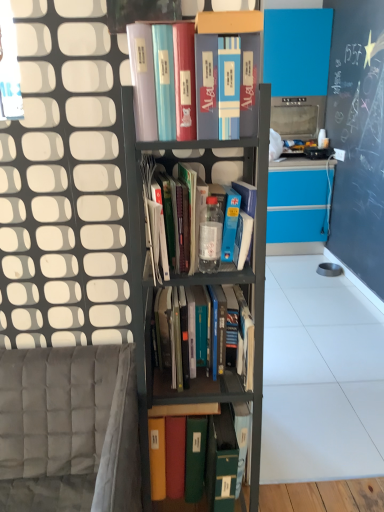
This screenshot has width=384, height=512. What do you see at coordinates (211, 163) in the screenshot?
I see `translucent plastic bottle at center, positioned as the 3th book in bottom-to-top order` at bounding box center [211, 163].

Measure the distance between point [252,49] and camera.

Point [252,49] is 97.00 centimeters away from camera.

The height and width of the screenshot is (512, 384). I want to click on green matte folder at center, the first book ordered from the bottom, so click(181, 409).

Is matte plastic books at upper center, the 1th book when ordered from top to bottom, far from gray fabric armchair at lower left?

They are positioned close to each other.

From a real-world perspective, is matte plastic books at upper center, which appears as the 4th book when ordered from the bottom, below gray fabric armchair at lower left?

No.

Looking at this image, does matte plastic books at upper center, the 1th book when ordered from top to bottom, appear on the right side of gray fabric armchair at lower left?

Yes.

From a real-world perspective, between translucent plastic bottle at center, positioned as the 3th book in bottom-to-top order, and green matte folder at center, the first book ordered from the bottom, who is vertically higher?

translucent plastic bottle at center, positioned as the 3th book in bottom-to-top order, from a real-world perspective.

Between translucent plastic bottle at center, positioned as the 2th book in top-to-bottom order, and green matte folder at center, the first book ordered from the bottom, which one has smaller width?

translucent plastic bottle at center, positioned as the 2th book in top-to-bottom order, is thinner.

From the picture: Is translucent plastic bottle at center, positioned as the 2th book in top-to-bottom order, situated inside green matte folder at center, which is the 4th book in top-to-bottom order, or outside?

The correct answer is: outside.

Measure the distance from translucent plastic bottle at center, positioned as the 3th book in bottom-to-top order, to green matte folder at center, which is the 4th book in top-to-bottom order.

translucent plastic bottle at center, positioned as the 3th book in bottom-to-top order, is 53.61 centimeters away from green matte folder at center, which is the 4th book in top-to-bottom order.

Is green matte folder at center, which is the 4th book in top-to-bottom order, next to metallic gray bookshelf at center?

No.

Between green matte folder at center, which is the 4th book in top-to-bottom order, and metallic gray bookshelf at center, which one appears on the left side from the viewer's perspective?

metallic gray bookshelf at center is more to the left.

Is green matte folder at center, the first book ordered from the bottom, not inside metallic gray bookshelf at center?

Actually, green matte folder at center, the first book ordered from the bottom, is at least partially inside metallic gray bookshelf at center.

Looking at this image, is translucent plastic bottle at center, positioned as the 2th book in top-to-bottom order, far from metallic gray bookshelf at center?

No, translucent plastic bottle at center, positioned as the 2th book in top-to-bottom order, is not far away from metallic gray bookshelf at center.

Looking at their sizes, would you say translucent plastic bottle at center, positioned as the 2th book in top-to-bottom order, is wider or thinner than metallic gray bookshelf at center?

translucent plastic bottle at center, positioned as the 2th book in top-to-bottom order, is thinner than metallic gray bookshelf at center.

Could you tell me if translucent plastic bottle at center, positioned as the 3th book in bottom-to-top order, is facing metallic gray bookshelf at center?

Yes, translucent plastic bottle at center, positioned as the 3th book in bottom-to-top order, is facing metallic gray bookshelf at center.

Is the depth of translucent plastic bottle at center, positioned as the 2th book in top-to-bottom order, less than that of metallic gray bookshelf at center?

No.

Is metallic gray bookshelf at center touching green matte folder at center, the first book ordered from the bottom?

No.

From the image's perspective, is metallic gray bookshelf at center located above green matte folder at center, which is the 4th book in top-to-bottom order?

Indeed, from the image's perspective, metallic gray bookshelf at center is shown above green matte folder at center, which is the 4th book in top-to-bottom order.

How distant is metallic gray bookshelf at center from green matte folder at center, which is the 4th book in top-to-bottom order?

metallic gray bookshelf at center and green matte folder at center, which is the 4th book in top-to-bottom order, are 13.38 inches apart.

From a real-world perspective, is metallic gray bookshelf at center positioned above or below green matte folder at center, which is the 4th book in top-to-bottom order?

In terms of real-world spatial position, metallic gray bookshelf at center is above green matte folder at center, which is the 4th book in top-to-bottom order.

Is metallic gray bookshelf at center oriented towards translucent plastic bottle at center, positioned as the 2th book in top-to-bottom order?

Yes, metallic gray bookshelf at center faces towards translucent plastic bottle at center, positioned as the 2th book in top-to-bottom order.

From a real-world perspective, which book is the 2nd one above the metallic gray bookshelf at center? Please provide its 2D coordinates.

[(211, 163)]

Considering the relative sizes of metallic gray bookshelf at center and translucent plastic bottle at center, positioned as the 3th book in bottom-to-top order, in the image provided, is metallic gray bookshelf at center smaller than translucent plastic bottle at center, positioned as the 3th book in bottom-to-top order,?

Actually, metallic gray bookshelf at center might be larger than translucent plastic bottle at center, positioned as the 3th book in bottom-to-top order.

Is metallic gray bookshelf at center spatially inside translucent plastic bottle at center, positioned as the 2th book in top-to-bottom order, or outside of it?

metallic gray bookshelf at center exists outside the volume of translucent plastic bottle at center, positioned as the 2th book in top-to-bottom order.

In terms of width, does metallic gray bookshelf at center look wider or thinner when compared to hardcover books at center, which appears as the 2th book when ordered from the bottom?

Clearly, metallic gray bookshelf at center has more width compared to hardcover books at center, which appears as the 2th book when ordered from the bottom.

Which is closer, (197, 403) or (198, 351)?

The point (197, 403) is in front.

Looking at this image, from a real-world perspective, who is located lower, metallic gray bookshelf at center or hardcover books at center, which appears as the 2th book when ordered from the bottom?

metallic gray bookshelf at center is physically lower.

Find the location of a particular element. The width and height of the screenshot is (384, 512). the 4th book above when counting from the gray fabric armchair at lower left (from the image's perspective) is located at coordinates (217, 66).

The width and height of the screenshot is (384, 512). I want to click on the 2nd book counting from the left side of the green matte folder at center, which is the 4th book in top-to-bottom order, so click(x=211, y=163).

From the image, which object appears to be farther from matte plastic books at upper center, the 1th book when ordered from top to bottom, metallic gray bookshelf at center or hardcover books at center, which appears as the 2th book when ordered from the bottom?

hardcover books at center, which appears as the 2th book when ordered from the bottom, is positioned further to the anchor matte plastic books at upper center, the 1th book when ordered from top to bottom.

Estimate the real-world distances between objects in this image. Which object is closer to matte plastic books at upper center, the 1th book when ordered from top to bottom, gray fabric armchair at lower left or hardcover books at center, the 3th book in the top-to-bottom sequence?

Based on the image, hardcover books at center, the 3th book in the top-to-bottom sequence, appears to be nearer to matte plastic books at upper center, the 1th book when ordered from top to bottom.

Based on their spatial positions, is metallic gray bookshelf at center or gray fabric armchair at lower left further from matte plastic books at upper center, which appears as the 4th book when ordered from the bottom?

gray fabric armchair at lower left is further to matte plastic books at upper center, which appears as the 4th book when ordered from the bottom.

When comparing their distances from metallic gray bookshelf at center, does hardcover books at center, the 3th book in the top-to-bottom sequence, or gray fabric armchair at lower left seem further?

gray fabric armchair at lower left.

From the image, which object appears to be farther from translucent plastic bottle at center, positioned as the 2th book in top-to-bottom order, green matte folder at center, the first book ordered from the bottom, or hardcover books at center, which appears as the 2th book when ordered from the bottom?

green matte folder at center, the first book ordered from the bottom, is positioned further to the anchor translucent plastic bottle at center, positioned as the 2th book in top-to-bottom order.

Based on their spatial positions, is gray fabric armchair at lower left or metallic gray bookshelf at center further from matte plastic books at upper center, the 1th book when ordered from top to bottom?

Among the two, gray fabric armchair at lower left is located further to matte plastic books at upper center, the 1th book when ordered from top to bottom.

Estimate the real-world distances between objects in this image. Which object is closer to green matte folder at center, the first book ordered from the bottom, translucent plastic bottle at center, positioned as the 2th book in top-to-bottom order, or hardcover books at center, which appears as the 2th book when ordered from the bottom?

Based on the image, hardcover books at center, which appears as the 2th book when ordered from the bottom, appears to be nearer to green matte folder at center, the first book ordered from the bottom.

Which object lies nearer to the anchor point translucent plastic bottle at center, positioned as the 2th book in top-to-bottom order, hardcover books at center, the 3th book in the top-to-bottom sequence, or matte plastic books at upper center, the 1th book when ordered from top to bottom?

hardcover books at center, the 3th book in the top-to-bottom sequence, is positioned closer to the anchor translucent plastic bottle at center, positioned as the 2th book in top-to-bottom order.

Locate an element on the screen. This screenshot has height=512, width=384. shelf between translucent plastic bottle at center, positioned as the 3th book in bottom-to-top order, and gray fabric armchair at lower left in the up-down direction is located at coordinates (191, 285).

Image resolution: width=384 pixels, height=512 pixels. I want to click on shelf that lies between translucent plastic bottle at center, positioned as the 3th book in bottom-to-top order, and green matte folder at center, the first book ordered from the bottom, from top to bottom, so click(x=191, y=285).

At what (x,y) coordinates should I click in order to perform the action: click on book between translucent plastic bottle at center, positioned as the 3th book in bottom-to-top order, and metallic gray bookshelf at center vertically. Please return your answer as a coordinate pair (x, y). This screenshot has height=512, width=384. Looking at the image, I should click on (188, 340).

The width and height of the screenshot is (384, 512). In order to click on shelf that lies between matte plastic books at upper center, which appears as the 4th book when ordered from the bottom, and gray fabric armchair at lower left from top to bottom in this screenshot , I will do `click(191, 285)`.